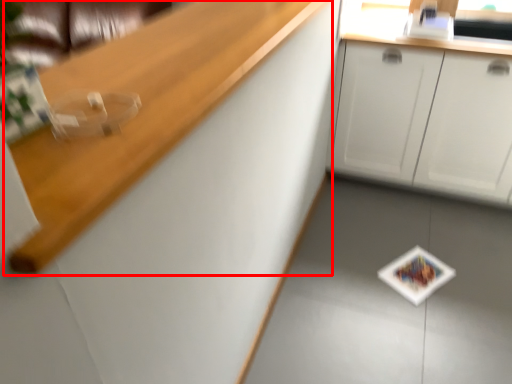
Question: From the image's perspective, considering the relative positions of counter top (annotated by the red box) and cabinetry in the image provided, where is counter top (annotated by the red box) located with respect to the staircase?

Choices:
 (A) below
 (B) above

Answer: (A)